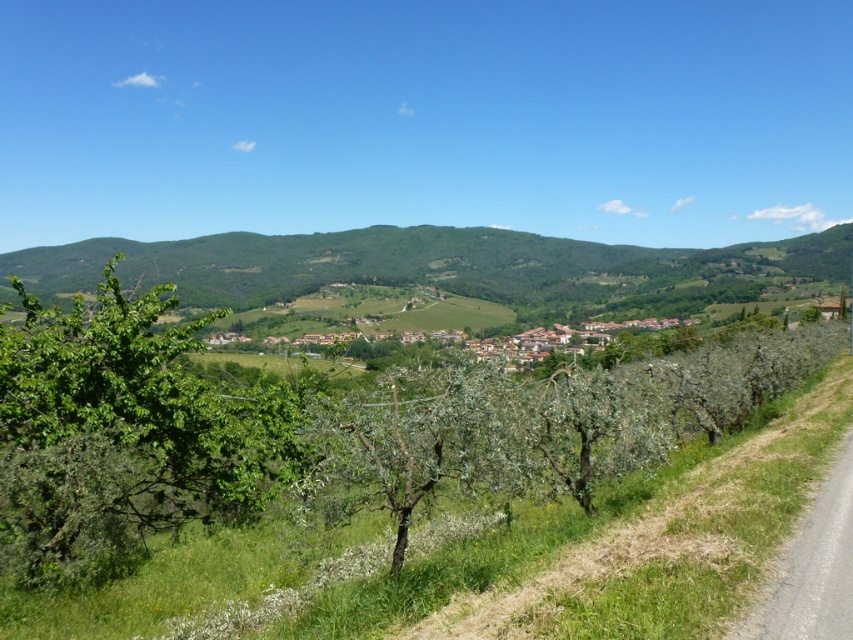
Question: Estimate the real-world distances between objects in this image. Which object is farther from the brown clay houses at center?

Choices:
 (A) green leafy hillside at center
 (B) green leafy tree at left

Answer: (A)

Question: Which point is closer to the camera?

Choices:
 (A) pos(84,509)
 (B) pos(424,273)
 (C) pos(552,340)

Answer: (A)

Question: Is green leafy tree at left thinner than brown clay houses at center?

Choices:
 (A) yes
 (B) no

Answer: (A)

Question: Which of the following is the farthest from the observer?

Choices:
 (A) (99, 346)
 (B) (575, 330)
 (C) (662, 284)

Answer: (C)

Question: Does green leafy hillside at center appear over brown clay houses at center?

Choices:
 (A) no
 (B) yes

Answer: (B)

Question: Is green leafy tree at left closer to the viewer compared to brown clay houses at center?

Choices:
 (A) yes
 (B) no

Answer: (B)